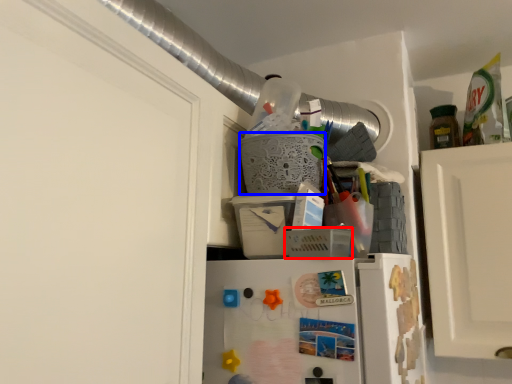
Question: Which object is further to the camera taking this photo, basket (highlighted by a red box) or basket (highlighted by a blue box)?

Choices:
 (A) basket
 (B) basket

Answer: (B)